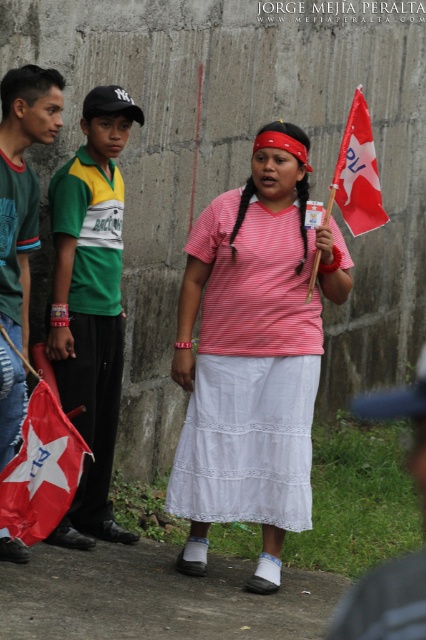
Question: Which point appears closest to the camera in this image?

Choices:
 (A) (388, 419)
 (B) (218, 260)
 (C) (43, 440)

Answer: (A)

Question: Is pink striped shirt at center above red fabric flag at lower left?

Choices:
 (A) yes
 (B) no

Answer: (A)

Question: Can you confirm if pink striped shirt at center is positioned to the right of green jersey at left?

Choices:
 (A) no
 (B) yes

Answer: (B)

Question: Does green jersey at left appear over red fabric flag at upper right?

Choices:
 (A) yes
 (B) no

Answer: (B)

Question: Which of the following is the closest to the observer?

Choices:
 (A) pink striped shirt at center
 (B) red fabric flag at upper right
 (C) dark gray fabric cap at upper left

Answer: (C)

Question: Which of the following is the farthest from the observer?

Choices:
 (A) dark gray fabric cap at upper left
 (B) red fabric flag at lower left
 (C) green jersey at left

Answer: (B)